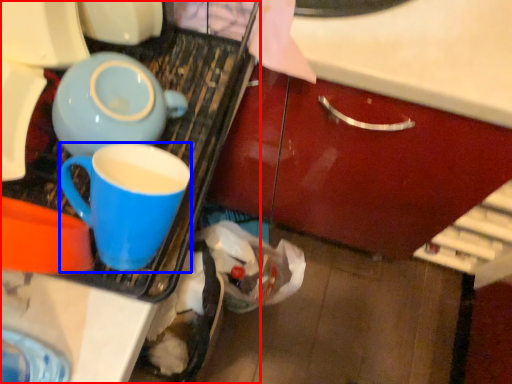
Question: Which object is further to the camera taking this photo, appliance (highlighted by a red box) or coffee cup (highlighted by a blue box)?

Choices:
 (A) appliance
 (B) coffee cup

Answer: (A)